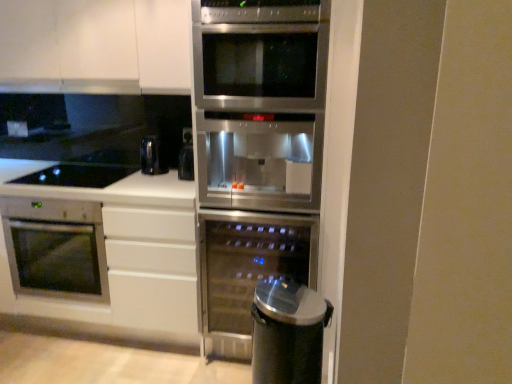
Question: Is sleek metallic trash can at lower right facing away from satin stainless steel wine cooler at center, the 2th oven from the left?

Choices:
 (A) yes
 (B) no

Answer: (A)

Question: Can you confirm if sleek metallic trash can at lower right is thinner than satin stainless steel wine cooler at center, the 2th oven from the left?

Choices:
 (A) no
 (B) yes

Answer: (B)

Question: Considering the relative sizes of sleek metallic trash can at lower right and satin stainless steel wine cooler at center, the 2th oven from the left, in the image provided, is sleek metallic trash can at lower right taller than satin stainless steel wine cooler at center, the 2th oven from the left,?

Choices:
 (A) yes
 (B) no

Answer: (B)

Question: From the image's perspective, is sleek metallic trash can at lower right above satin stainless steel wine cooler at center, the 2th oven from the left?

Choices:
 (A) yes
 (B) no

Answer: (B)

Question: Are sleek metallic trash can at lower right and satin stainless steel wine cooler at center, the 2th oven from the left, far apart?

Choices:
 (A) no
 (B) yes

Answer: (A)

Question: Is sleek metallic trash can at lower right inside the boundaries of black glass cooktop at lower left, or outside?

Choices:
 (A) outside
 (B) inside

Answer: (A)

Question: Considering their positions, is sleek metallic trash can at lower right located in front of or behind black glass cooktop at lower left?

Choices:
 (A) front
 (B) behind

Answer: (A)

Question: From the image's perspective, relative to black glass cooktop at lower left, is sleek metallic trash can at lower right above or below?

Choices:
 (A) below
 (B) above

Answer: (A)

Question: In the image, is sleek metallic trash can at lower right on the left side or the right side of black glass cooktop at lower left?

Choices:
 (A) right
 (B) left

Answer: (A)

Question: Visually, is sleek metallic trash can at lower right positioned to the left or to the right of stainless steel fridge at center?

Choices:
 (A) right
 (B) left

Answer: (A)

Question: Is sleek metallic trash can at lower right in front of or behind stainless steel fridge at center in the image?

Choices:
 (A) front
 (B) behind

Answer: (A)

Question: From the image's perspective, relative to stainless steel fridge at center, is sleek metallic trash can at lower right above or below?

Choices:
 (A) below
 (B) above

Answer: (A)

Question: Considering the positions of point (282, 292) and point (237, 11), is point (282, 292) closer or farther from the camera than point (237, 11)?

Choices:
 (A) farther
 (B) closer

Answer: (A)

Question: Considering the positions of white matte countertop at lower left and satin silver exhaust hood at upper center in the image, is white matte countertop at lower left taller or shorter than satin silver exhaust hood at upper center?

Choices:
 (A) short
 (B) tall

Answer: (B)

Question: From the image's perspective, is white matte countertop at lower left positioned above or below satin silver exhaust hood at upper center?

Choices:
 (A) below
 (B) above

Answer: (A)